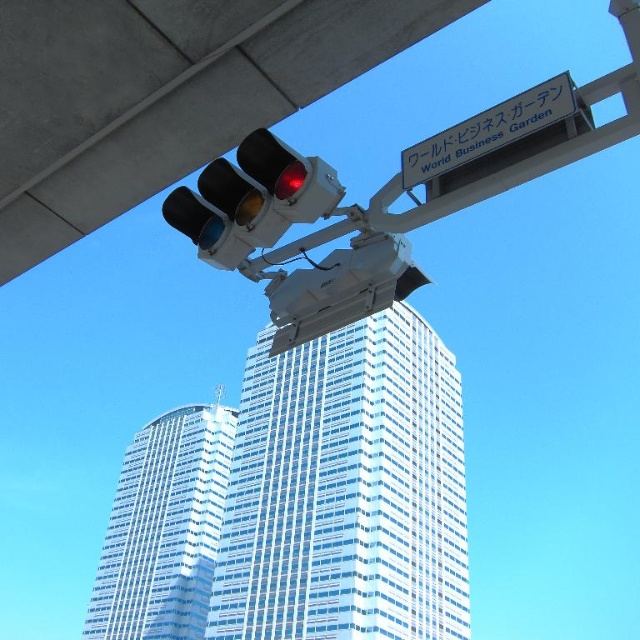
You are standing at the base of the skyscraper and want to locate two points marked in the image. Which point is closer to you, the viewer? The points are labeled as point (132, 584) and point (292, 205).

Point (132, 584) is closer to the viewer than point (292, 205) because it is further to the viewer according to the description.

You are a pedestrian standing at the intersection and see the matte black traffic light at upper center and the white plastic sign at upper center. Which object is located to the left side?

The matte black traffic light at upper center is positioned on the left side of white plastic sign at upper center.

You are a photographer trying to capture the entire World Business Garden signboard and the traffic light in one frame. Given that the matte black traffic light at upper center is smaller than the white plastic sign at upper center, which object should you adjust your camera focus on to ensure both are in frame without cropping?

Since the matte black traffic light at upper center is smaller than the white plastic sign at upper center, you should focus on the larger white plastic sign at upper center to ensure both fit within the frame.